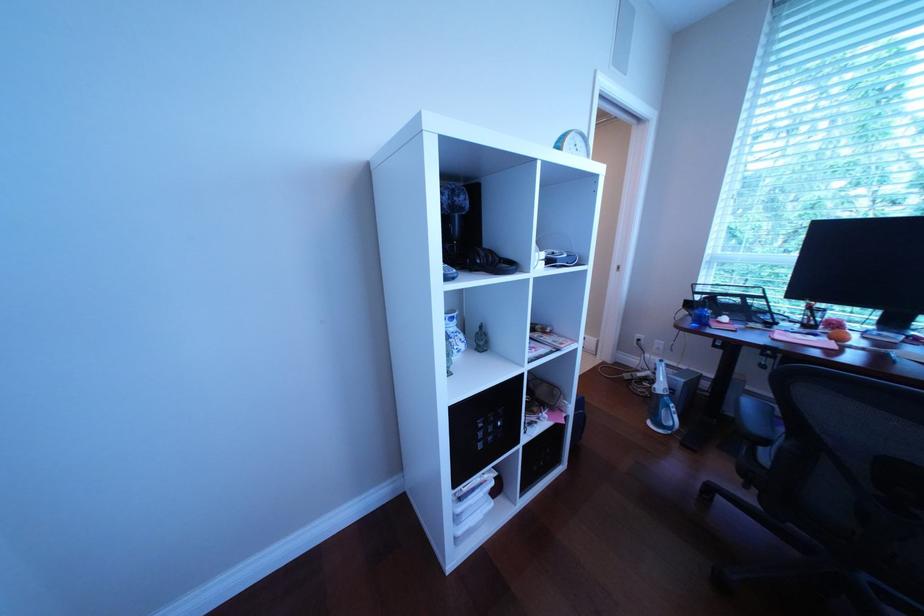
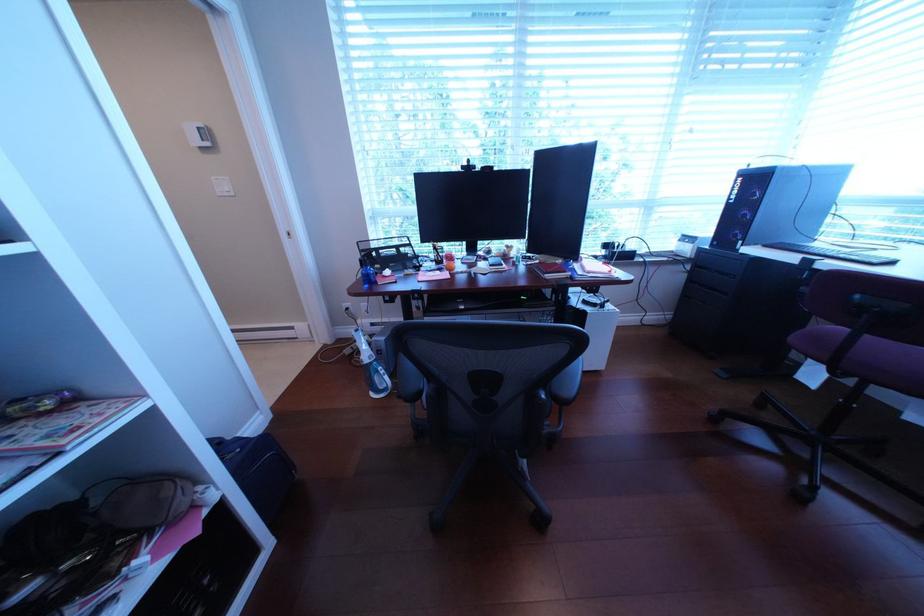
Question: Based on the continuous images, in which direction is the camera rotating? Reply with the corresponding letter.

Choices:
 (A) Left
 (B) Right
 (C) Up
 (D) Down

Answer: (B)